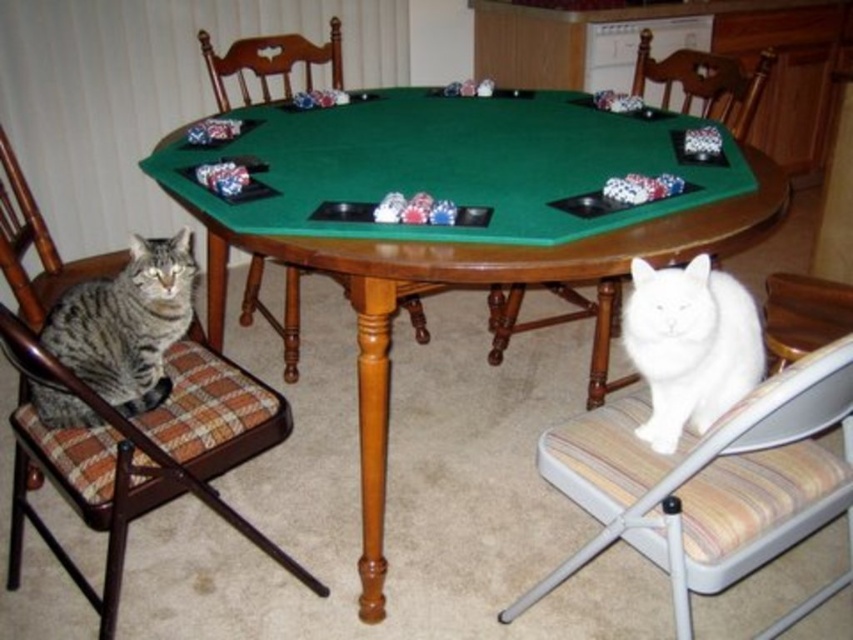
You are trying to decide which chair to sit on between the white fabric chair at lower right and the wooden chair at center. Which chair has a wider seat?

The white fabric chair at lower right might be wider than wooden chair at center, so it could have a wider seat.

You are a person who is 5 feet tall and wants to sit on the brown plaid cushioned chair at left. The chair is 3.58 feet away from you. Can you reach the chair without moving your feet?

The brown plaid cushioned chair at left is 3.58 feet away from you. Since you are 5 feet tall, you can easily reach the chair without moving your feet as the distance is within a comfortable arm reach.